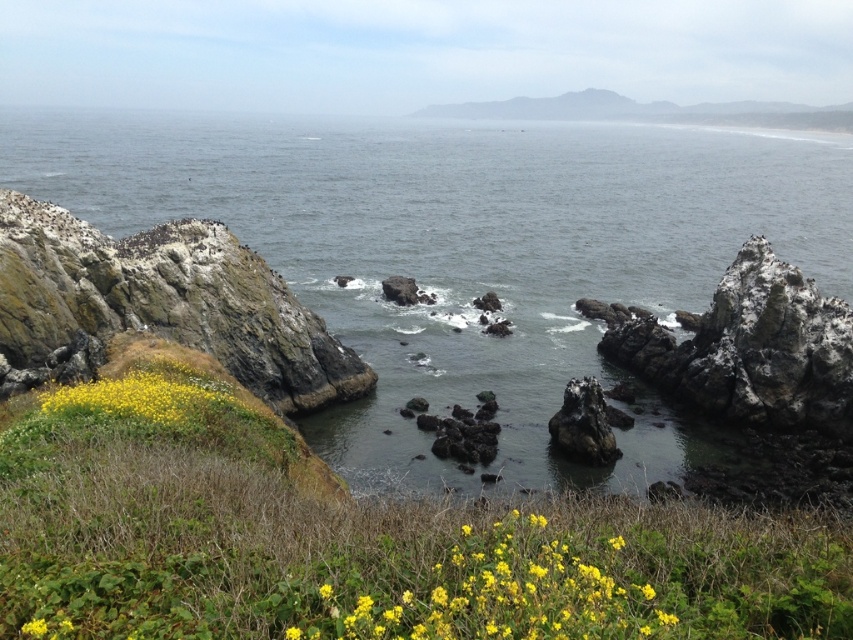
You are standing at the point closest to the viewer in the coastal landscape. Which point, point (86, 291) or point (648, 627), is farther away from you?

Point (86, 291) is behind point (648, 627), so it is farther away from you.

You are standing on the grassy slope with yellow wildflowers in the coastal landscape. You see two points marked on the image. Which point is closer to you, point (x=397, y=339) or point (x=213, y=323)?

Point (x=213, y=323) is closer to you because it is less further to the camera than point (x=397, y=339).